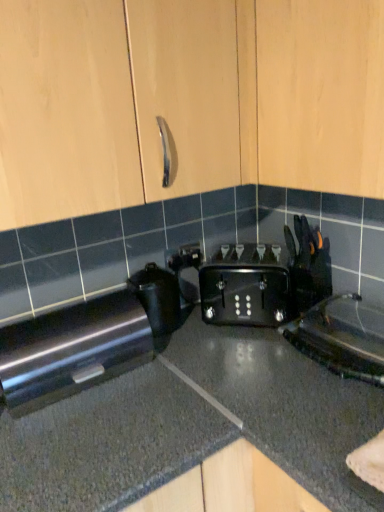
Question: From the image's perspective, is light wood cabinet at upper center on black plastic toaster at center, which ranks as the 2th appliance in right-to-left order?

Choices:
 (A) no
 (B) yes

Answer: (B)

Question: Does light wood cabinet at upper center appear on the right side of black plastic toaster at center, which ranks as the 2th appliance in right-to-left order?

Choices:
 (A) yes
 (B) no

Answer: (A)

Question: Is light wood cabinet at upper center thinner than black plastic toaster at center, which ranks as the first appliance in left-to-right order?

Choices:
 (A) yes
 (B) no

Answer: (B)

Question: Is light wood cabinet at upper center not close to black plastic toaster at center, which ranks as the first appliance in left-to-right order?

Choices:
 (A) yes
 (B) no

Answer: (B)

Question: From the image's perspective, does light wood cabinet at upper center appear lower than black plastic toaster at center, which ranks as the 2th appliance in right-to-left order?

Choices:
 (A) yes
 (B) no

Answer: (B)

Question: Considering the positions of black plastic toaster at center, which ranks as the first appliance in left-to-right order, and black granite countertop at center in the image, is black plastic toaster at center, which ranks as the first appliance in left-to-right order, wider or thinner than black granite countertop at center?

Choices:
 (A) wide
 (B) thin

Answer: (B)

Question: Considering the relative positions of black plastic toaster at center, which ranks as the first appliance in left-to-right order, and black granite countertop at center in the image provided, is black plastic toaster at center, which ranks as the first appliance in left-to-right order, to the left or to the right of black granite countertop at center?

Choices:
 (A) right
 (B) left

Answer: (B)

Question: From a real-world perspective, relative to black granite countertop at center, is black plastic toaster at center, which ranks as the 2th appliance in right-to-left order, vertically above or below?

Choices:
 (A) above
 (B) below

Answer: (A)

Question: In the image, is black plastic toaster at center, which ranks as the first appliance in left-to-right order, positioned in front of or behind black granite countertop at center?

Choices:
 (A) front
 (B) behind

Answer: (B)

Question: Do you think light wood cabinet at upper center is within satin black toaster at lower left, or outside of it?

Choices:
 (A) inside
 (B) outside

Answer: (B)

Question: Considering the positions of point (357, 95) and point (127, 309), is point (357, 95) closer or farther from the camera than point (127, 309)?

Choices:
 (A) closer
 (B) farther

Answer: (A)

Question: Is light wood cabinet at upper center in front of or behind satin black toaster at lower left in the image?

Choices:
 (A) front
 (B) behind

Answer: (A)

Question: Considering the positions of light wood cabinet at upper center and satin black toaster at lower left in the image, is light wood cabinet at upper center taller or shorter than satin black toaster at lower left?

Choices:
 (A) short
 (B) tall

Answer: (B)

Question: Is black plastic kettle at lower right, the 2th appliance in the left-to-right sequence, wider or thinner than satin black toaster at lower left?

Choices:
 (A) thin
 (B) wide

Answer: (B)

Question: Considering the positions of black plastic kettle at lower right, the first appliance positioned from the right, and satin black toaster at lower left in the image, is black plastic kettle at lower right, the first appliance positioned from the right, bigger or smaller than satin black toaster at lower left?

Choices:
 (A) big
 (B) small

Answer: (B)